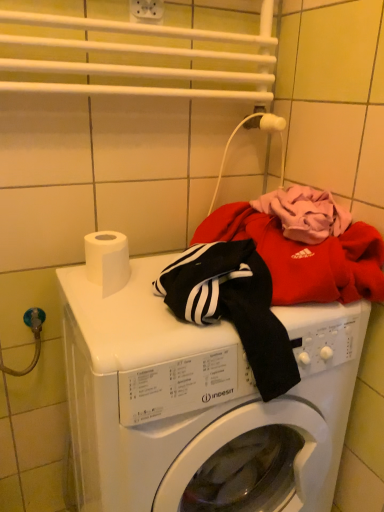
You are a GUI agent. You are given a task and a screenshot of the screen. Output one action in this format:
    pyautogui.click(x=<x>, y=<y>)
    Task: Click on the white glossy washing machine at center
    
    Given the screenshot: What is the action you would take?
    pyautogui.click(x=200, y=403)

I want to click on white plastic electric outlet at upper center, so click(x=147, y=11).

Does white matte toilet paper at top left have a greater width compared to white plastic electric outlet at upper center?

Correct, the width of white matte toilet paper at top left exceeds that of white plastic electric outlet at upper center.

Between white matte toilet paper at top left and white plastic electric outlet at upper center, which one has less height?

Standing shorter between the two is white plastic electric outlet at upper center.

Would you consider white matte toilet paper at top left to be distant from white plastic electric outlet at upper center?

They are positioned close to each other.

This screenshot has width=384, height=512. I want to click on electric outlet that is on the right side of white matte toilet paper at top left, so click(147, 11).

Which is correct: white glossy washing machine at center is inside white matte toilet paper at top left, or outside of it?

white glossy washing machine at center lies outside white matte toilet paper at top left.

Considering the relative sizes of white glossy washing machine at center and white matte toilet paper at top left in the image provided, is white glossy washing machine at center smaller than white matte toilet paper at top left?

No.

Does white glossy washing machine at center have a lesser height compared to white matte toilet paper at top left?

Incorrect, the height of white glossy washing machine at center does not fall short of that of white matte toilet paper at top left.

In the scene shown: Can you see white glossy washing machine at center touching white matte toilet paper at top left?

No, white glossy washing machine at center is not with white matte toilet paper at top left.

Which of these two, white matte toilet paper at top left or white glossy washing machine at center, is bigger?

Bigger between the two is white glossy washing machine at center.

Measure the distance between white matte toilet paper at top left and white glossy washing machine at center.

A distance of 12.56 inches exists between white matte toilet paper at top left and white glossy washing machine at center.

Is white matte toilet paper at top left taller or shorter than white glossy washing machine at center?

In the image, white matte toilet paper at top left appears to be shorter than white glossy washing machine at center.

Image resolution: width=384 pixels, height=512 pixels. In order to click on toilet paper that appears above the white glossy washing machine at center (from a real-world perspective) in this screenshot , I will do `click(107, 260)`.

Is white plastic electric outlet at upper center directly adjacent to white matte toilet paper at top left?

No.

Between white plastic electric outlet at upper center and white matte toilet paper at top left, which one appears on the right side from the viewer's perspective?

white plastic electric outlet at upper center is more to the right.

Is point (149, 1) behind point (95, 269)?

Yes, it is behind point (95, 269).

Can you confirm if white plastic electric outlet at upper center is bigger than white matte toilet paper at top left?

Actually, white plastic electric outlet at upper center might be smaller than white matte toilet paper at top left.

Between white plastic electric outlet at upper center and white glossy washing machine at center, which one appears on the right side from the viewer's perspective?

white glossy washing machine at center.

You are a GUI agent. You are given a task and a screenshot of the screen. Output one action in this format:
    pyautogui.click(x=<x>, y=<y>)
    Task: Click on the washing machine to the right of white plastic electric outlet at upper center
    The width and height of the screenshot is (384, 512).
    Given the screenshot: What is the action you would take?
    pyautogui.click(x=200, y=403)

From the image's perspective, who appears lower, white plastic electric outlet at upper center or white glossy washing machine at center?

From the image's view, white glossy washing machine at center is below.

Which of these two, white plastic electric outlet at upper center or white glossy washing machine at center, is bigger?

white glossy washing machine at center is bigger.

Can you confirm if white glossy washing machine at center is shorter than white plastic electric outlet at upper center?

No, white glossy washing machine at center is not shorter than white plastic electric outlet at upper center.

From the image's perspective, is white glossy washing machine at center located above white plastic electric outlet at upper center?

No, from the image's perspective, white glossy washing machine at center is not over white plastic electric outlet at upper center.

What's the angular difference between white glossy washing machine at center and white plastic electric outlet at upper center's facing directions?

0.775 degrees separate the facing orientations of white glossy washing machine at center and white plastic electric outlet at upper center.

Which is behind, white glossy washing machine at center or white plastic electric outlet at upper center?

white plastic electric outlet at upper center is more distant.

Find the location of a particular element. Image resolution: width=384 pixels, height=512 pixels. electric outlet that is on the right side of white matte toilet paper at top left is located at coordinates pos(147,11).

The width and height of the screenshot is (384, 512). Find the location of `toilet paper located on the left of white glossy washing machine at center`. toilet paper located on the left of white glossy washing machine at center is located at coordinates (107, 260).

Which object lies further to the anchor point white matte toilet paper at top left, white plastic electric outlet at upper center or white glossy washing machine at center?

Based on the image, white plastic electric outlet at upper center appears to be further to white matte toilet paper at top left.

Based on their spatial positions, is white matte toilet paper at top left or white plastic electric outlet at upper center closer to white glossy washing machine at center?

white matte toilet paper at top left is positioned closer to the anchor white glossy washing machine at center.

In the scene shown: Considering their positions, is white glossy washing machine at center positioned further to white plastic electric outlet at upper center than white matte toilet paper at top left?

Among the two, white glossy washing machine at center is located further to white plastic electric outlet at upper center.

Which object lies nearer to the anchor point white glossy washing machine at center, white plastic electric outlet at upper center or white matte toilet paper at top left?

white matte toilet paper at top left lies closer to white glossy washing machine at center than the other object.

Based on their spatial positions, is white matte toilet paper at top left or white glossy washing machine at center further from white plastic electric outlet at upper center?

Among the two, white glossy washing machine at center is located further to white plastic electric outlet at upper center.

Looking at the image, which one is located closer to white matte toilet paper at top left, white glossy washing machine at center or white plastic electric outlet at upper center?

white glossy washing machine at center lies closer to white matte toilet paper at top left than the other object.

In order to click on toilet paper between white plastic electric outlet at upper center and white glossy washing machine at center in the up-down direction in this screenshot , I will do `click(107, 260)`.